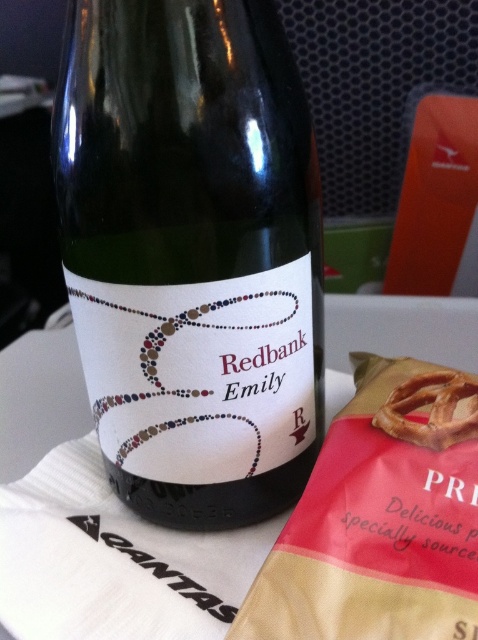
Question: Does green glass bottle at center have a lesser width compared to golden brown pretzel at center?

Choices:
 (A) yes
 (B) no

Answer: (B)

Question: Is green glass bottle at center below golden brown pretzel at center?

Choices:
 (A) yes
 (B) no

Answer: (B)

Question: Which object appears farthest from the camera in this image?

Choices:
 (A) golden brown pretzel at center
 (B) green glass bottle at center

Answer: (A)

Question: Does green glass bottle at center appear under golden brown pretzel at center?

Choices:
 (A) no
 (B) yes

Answer: (A)